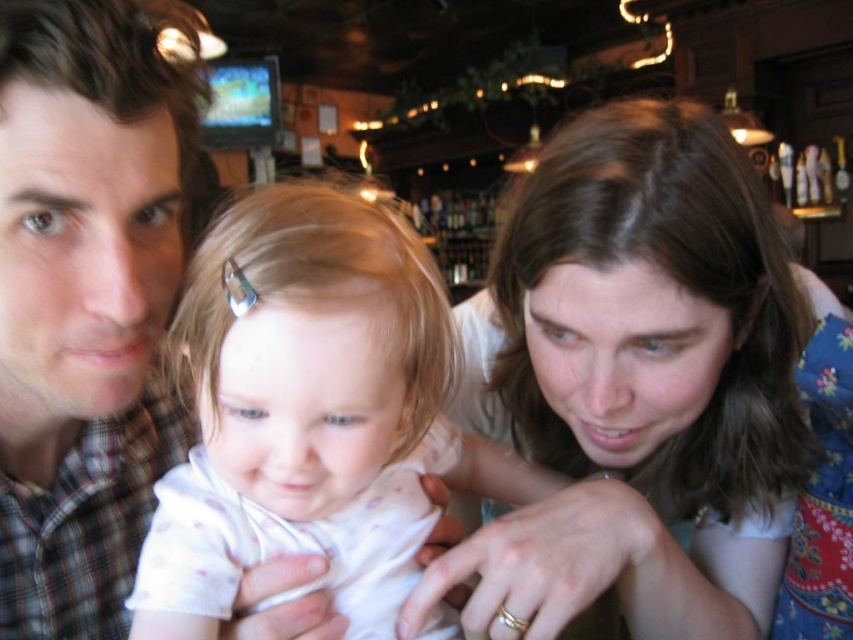
Which is in front, point (308, 253) or point (10, 461)?

Positioned in front is point (308, 253).

Between white fabric baby at center and plaid shirt at left, which one is positioned higher?

plaid shirt at left

Is point (368, 264) behind point (115, 145)?

No, it is in front of (115, 145).

Locate an element on the screen. Image resolution: width=853 pixels, height=640 pixels. white fabric baby at center is located at coordinates (311, 413).

Does smooth brown hair at center come in front of plaid shirt at left?

No, smooth brown hair at center is behind plaid shirt at left.

This screenshot has width=853, height=640. What do you see at coordinates (641, 385) in the screenshot? I see `smooth brown hair at center` at bounding box center [641, 385].

Describe the element at coordinates (641, 385) in the screenshot. I see `smooth brown hair at center` at that location.

Locate an element on the screen. The width and height of the screenshot is (853, 640). smooth brown hair at center is located at coordinates (641, 385).

Is point (494, 292) closer to camera compared to point (328, 528)?

No, (494, 292) is behind (328, 528).

Is smooth brown hair at center positioned before white fabric baby at center?

No, smooth brown hair at center is further to the viewer.

This screenshot has width=853, height=640. What do you see at coordinates (641, 385) in the screenshot? I see `smooth brown hair at center` at bounding box center [641, 385].

In order to click on smooth brown hair at center in this screenshot , I will do `click(641, 385)`.